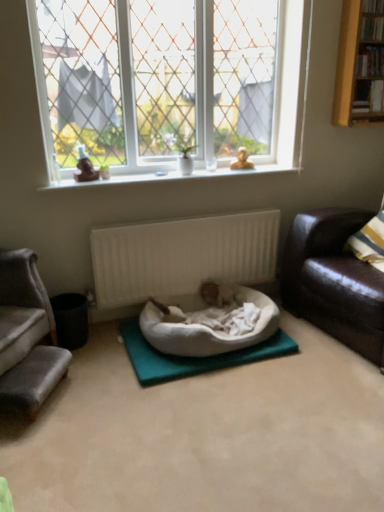
Question: In terms of height, does white soft dog bed at center look taller or shorter compared to black matte trash bin at lower left?

Choices:
 (A) short
 (B) tall

Answer: (A)

Question: From a real-world perspective, is white soft dog bed at center physically located above or below black matte trash bin at lower left?

Choices:
 (A) above
 (B) below

Answer: (A)

Question: Considering the real-world distances, which object is farthest from the yellow wood bookshelf at upper right?

Choices:
 (A) shiny brown leather couch at right, the first studio couch from the right
 (B) white ceramic vase at upper center
 (C) white fabric yoga mat at center
 (D) white matte radiator at center
 (E) black matte trash bin at lower left

Answer: (E)

Question: Which is nearer to the clear glass window at upper center?

Choices:
 (A) white fabric yoga mat at center
 (B) shiny brown leather couch at right, the first studio couch from the right
 (C) white ceramic vase at upper center
 (D) white matte radiator at center
 (E) velvet grey couch at left, which is the first studio couch from left to right

Answer: (C)